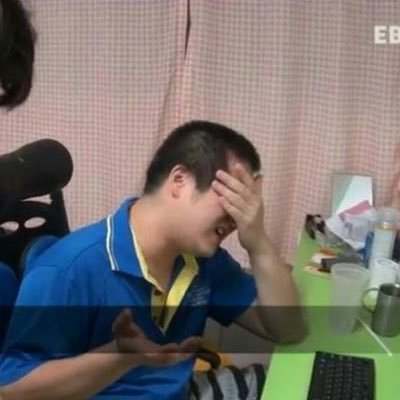
The width and height of the screenshot is (400, 400). Identify the location of plastic container. (350, 291), (381, 235), (382, 270).